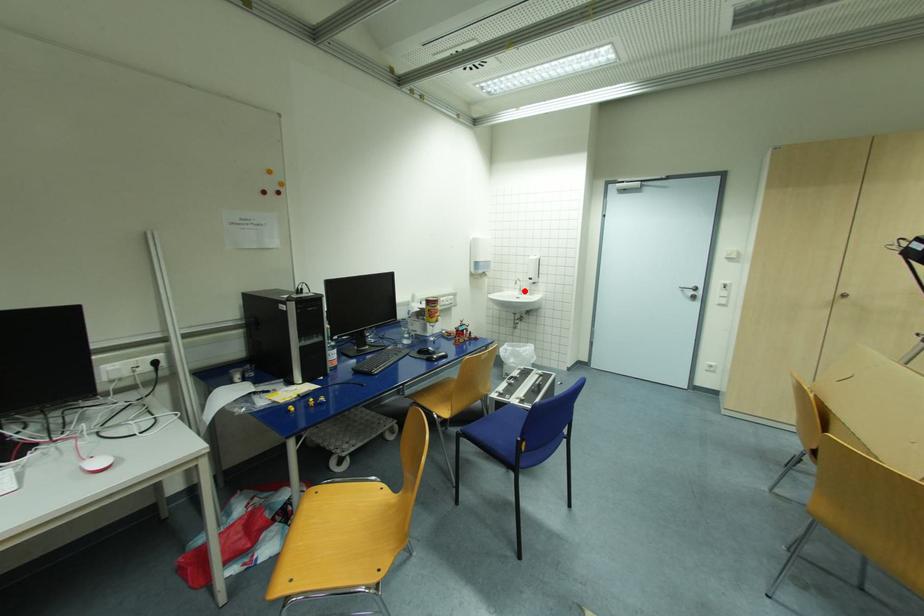
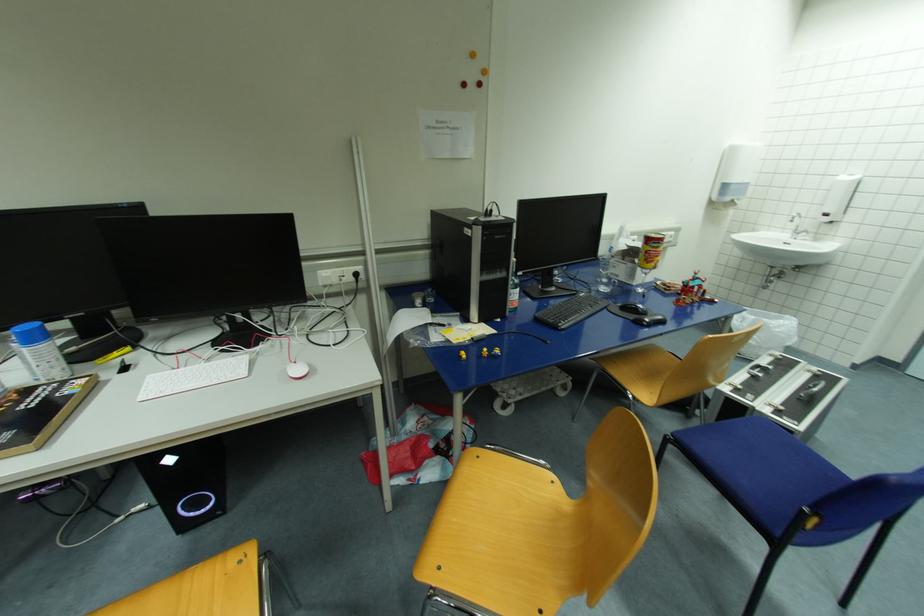
Question: I am providing you with two images of the same scene from different viewpoints. In image1, a red point is highlighted. Considering the same 3D point in image2, which of the following is correct?

Choices:
 (A) It is closer
 (B) It is farther

Answer: (B)